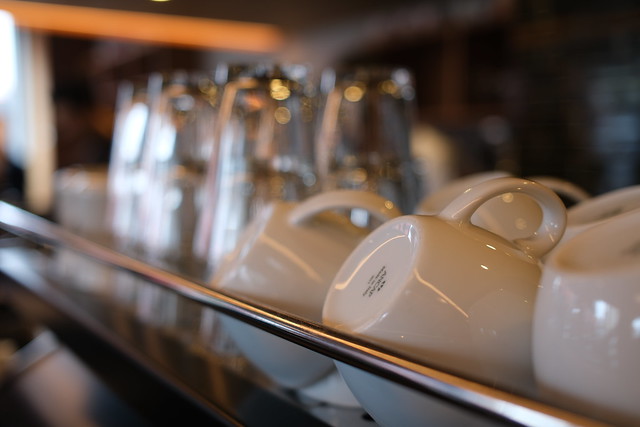
The width and height of the screenshot is (640, 427). Identify the location of mugs. (314, 245), (448, 193), (596, 211), (604, 265), (428, 270).